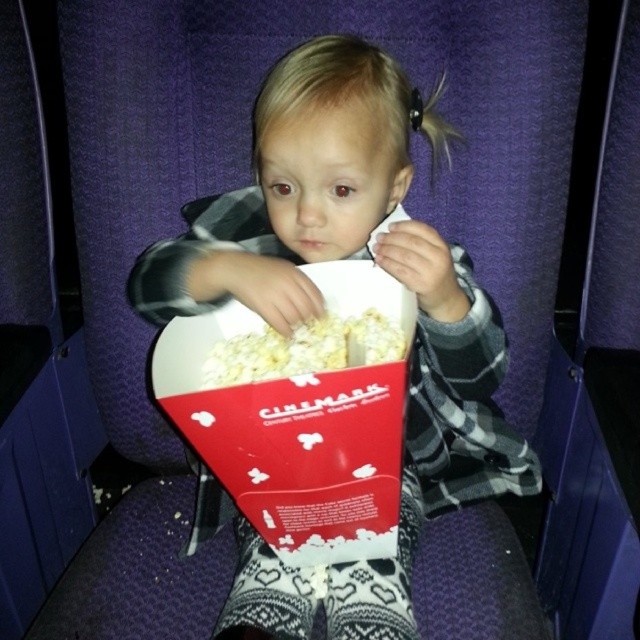
Does point (316, 51) come farther from viewer compared to point (323, 346)?

Yes, point (316, 51) is farther from viewer.

This screenshot has height=640, width=640. What are the coordinates of `white matte popcorn at center` in the screenshot? It's located at (355, 257).